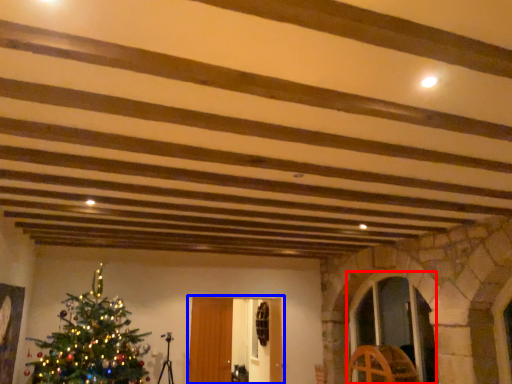
Question: Which point is closer to the camera, glass door (highlighted by a red box) or glass door (highlighted by a blue box)?

Choices:
 (A) glass door
 (B) glass door

Answer: (A)